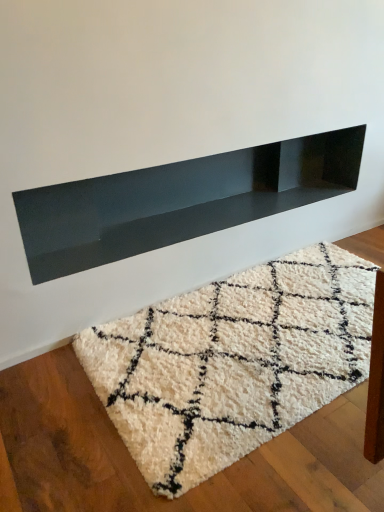
The height and width of the screenshot is (512, 384). Identify the location of glossy black shelf at upper center. (179, 201).

What do you see at coordinates (179, 201) in the screenshot?
I see `glossy black shelf at upper center` at bounding box center [179, 201].

This screenshot has width=384, height=512. Describe the element at coordinates (232, 362) in the screenshot. I see `white shaggy rug at center` at that location.

Identify the location of white shaggy rug at center. The height and width of the screenshot is (512, 384). (232, 362).

Image resolution: width=384 pixels, height=512 pixels. Identify the location of glossy black shelf at upper center. (179, 201).

Which object is positioned more to the left, glossy black shelf at upper center or white shaggy rug at center?

From the viewer's perspective, glossy black shelf at upper center appears more on the left side.

Does glossy black shelf at upper center come in front of white shaggy rug at center?

No, the depth of glossy black shelf at upper center is greater than that of white shaggy rug at center.

Which is behind, point (333, 158) or point (302, 306)?

The point (333, 158) is farther from the camera.

From the image's perspective, which object appears higher, glossy black shelf at upper center or white shaggy rug at center?

glossy black shelf at upper center appears higher in the image.

From a real-world perspective, is glossy black shelf at upper center on white shaggy rug at center?

Indeed, from a real-world perspective, glossy black shelf at upper center stands above white shaggy rug at center.

Is glossy black shelf at upper center wider than white shaggy rug at center?

No.

Between glossy black shelf at upper center and white shaggy rug at center, which one has less height?

Standing shorter between the two is white shaggy rug at center.

Who is bigger, glossy black shelf at upper center or white shaggy rug at center?

Bigger between the two is glossy black shelf at upper center.

Choose the correct answer: Is glossy black shelf at upper center inside white shaggy rug at center or outside it?

glossy black shelf at upper center is not inside white shaggy rug at center, it's outside.

Is glossy black shelf at upper center positioned far away from white shaggy rug at center?

glossy black shelf at upper center is near white shaggy rug at center, not far away.

Is white shaggy rug at center at the back of glossy black shelf at upper center?

glossy black shelf at upper center is not turned away from white shaggy rug at center.

Locate an element on the screen. shelf behind the white shaggy rug at center is located at coordinates (179, 201).

Based on their positions, is white shaggy rug at center located to the left or right of glossy black shelf at upper center?

From the image, it's evident that white shaggy rug at center is to the right of glossy black shelf at upper center.

Which is behind, white shaggy rug at center or glossy black shelf at upper center?

glossy black shelf at upper center is behind.

Which is in front, point (266, 308) or point (297, 175)?

The point (266, 308) is closer to the camera.

From the image's perspective, does white shaggy rug at center appear lower than glossy black shelf at upper center?

Yes, from the image's perspective, white shaggy rug at center is beneath glossy black shelf at upper center.

From a real-world perspective, is white shaggy rug at center positioned over glossy black shelf at upper center based on gravity?

No, from a real-world perspective, white shaggy rug at center is not on top of glossy black shelf at upper center.

Which of these two, white shaggy rug at center or glossy black shelf at upper center, is wider?

Wider between the two is white shaggy rug at center.

Between white shaggy rug at center and glossy black shelf at upper center, which one has less height?

With less height is white shaggy rug at center.

Can you confirm if white shaggy rug at center is bigger than glossy black shelf at upper center?

Actually, white shaggy rug at center might be smaller than glossy black shelf at upper center.

Would you say glossy black shelf at upper center is part of white shaggy rug at center's contents?

That's incorrect, glossy black shelf at upper center is not inside white shaggy rug at center.

Is white shaggy rug at center not close to glossy black shelf at upper center?

They are positioned close to each other.

Is white shaggy rug at center looking in the opposite direction of glossy black shelf at upper center?

white shaggy rug at center is not turned away from glossy black shelf at upper center.

The width and height of the screenshot is (384, 512). I want to click on mat below the glossy black shelf at upper center (from a real-world perspective), so pos(232,362).

Locate an element on the screen. The width and height of the screenshot is (384, 512). mat that appears in front of the glossy black shelf at upper center is located at coordinates (232, 362).

Locate an element on the screen. The image size is (384, 512). shelf to the left of white shaggy rug at center is located at coordinates (179, 201).